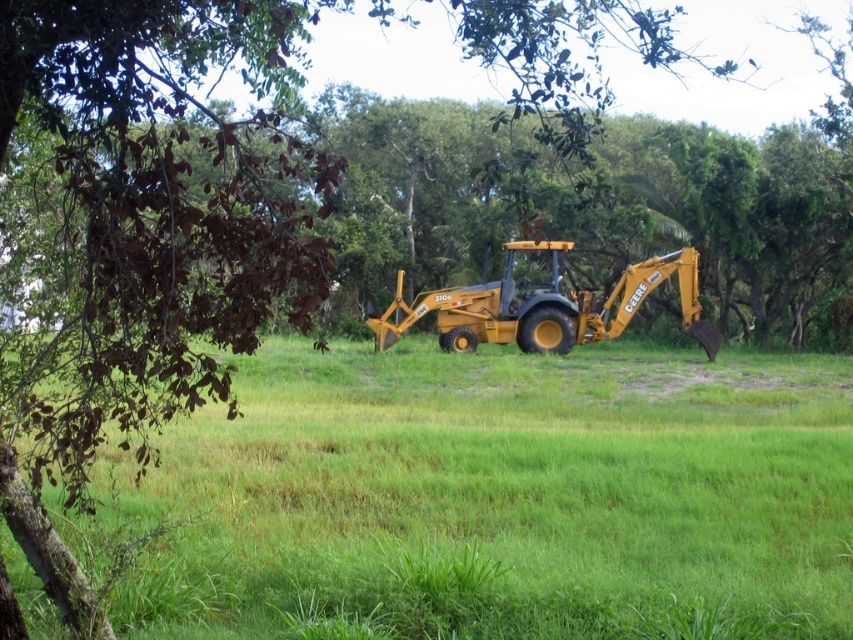
Who is lower down, yellow rubber tractor at center or yellow metallic tractor at center?

yellow rubber tractor at center

Is point (384, 531) positioned before point (553, 316)?

Yes, it is in front of point (553, 316).

Which is in front, point (567, 636) or point (454, 339)?

Point (567, 636) is more forward.

Find the location of a particular element. The image size is (853, 640). yellow rubber tractor at center is located at coordinates (515, 481).